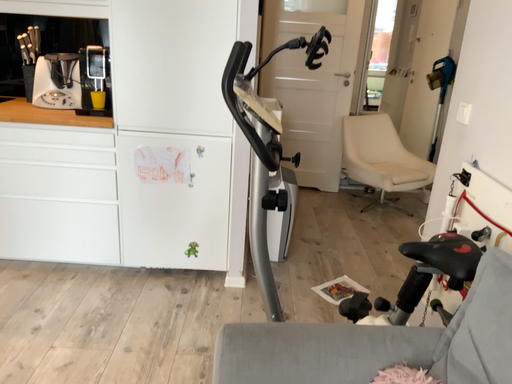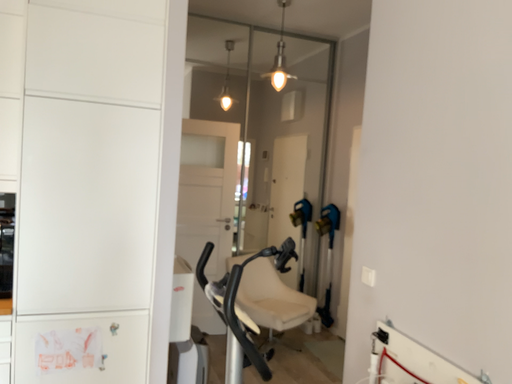
Question: Which way did the camera rotate in the video?

Choices:
 (A) rotated right
 (B) rotated left

Answer: (A)